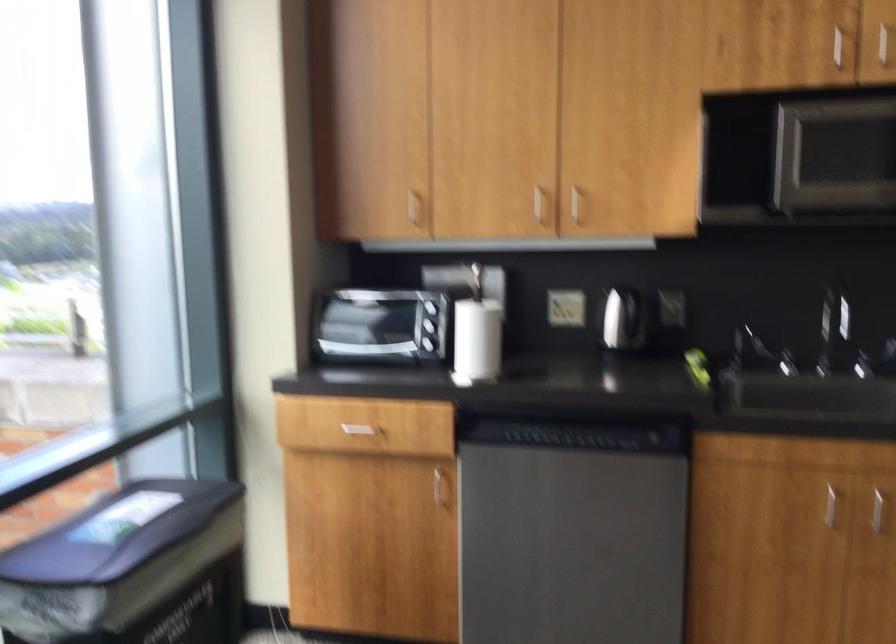
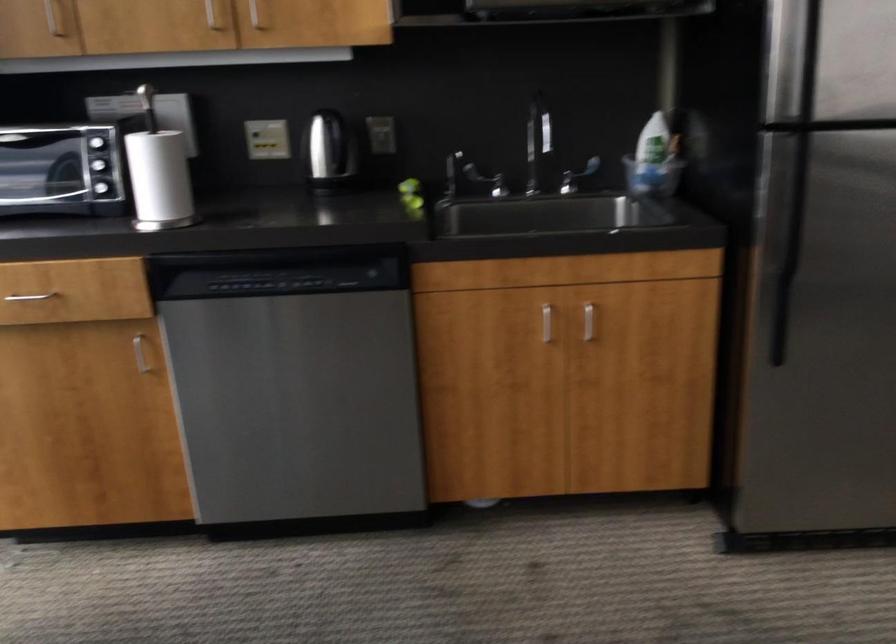
The point at (437,488) is marked in the first image. Where is the corresponding point in the second image?

(140, 354)